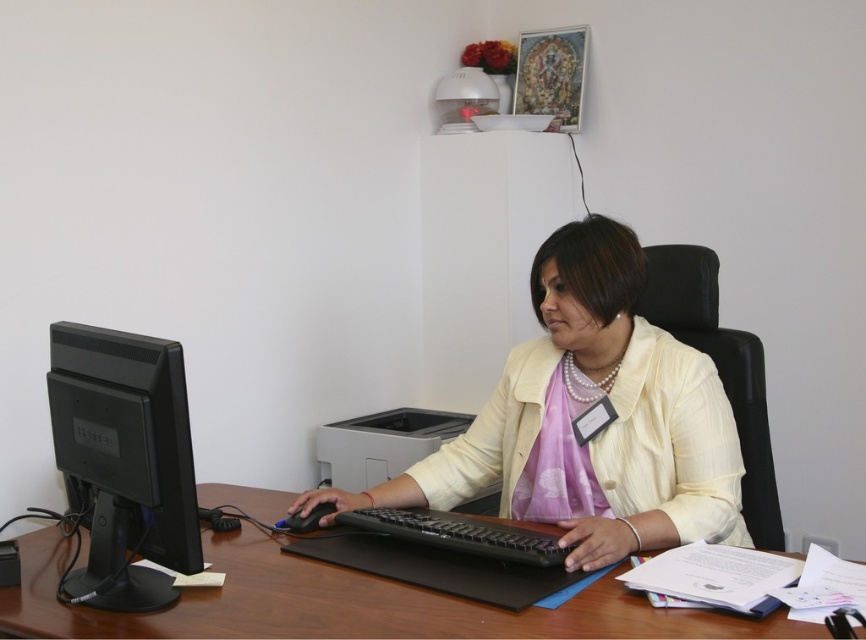
Question: Which object appears closest to the camera in this image?

Choices:
 (A) brown wooden desk at center
 (B) matte white jacket at center

Answer: (A)

Question: Is brown wooden desk at center to the right of black matte mouse at center from the viewer's perspective?

Choices:
 (A) yes
 (B) no

Answer: (A)

Question: Which point is closer to the camera?

Choices:
 (A) (352, 628)
 (B) (379, 486)

Answer: (A)

Question: Is matte white jacket at center smaller than black plastic keyboard at center?

Choices:
 (A) yes
 (B) no

Answer: (B)

Question: Can you confirm if matte white jacket at center is positioned above black glossy monitor at left?

Choices:
 (A) yes
 (B) no

Answer: (B)

Question: Which of the following is the farthest from the observer?

Choices:
 (A) (326, 506)
 (B) (563, 280)
 (C) (477, 547)
 (D) (79, 429)

Answer: (A)